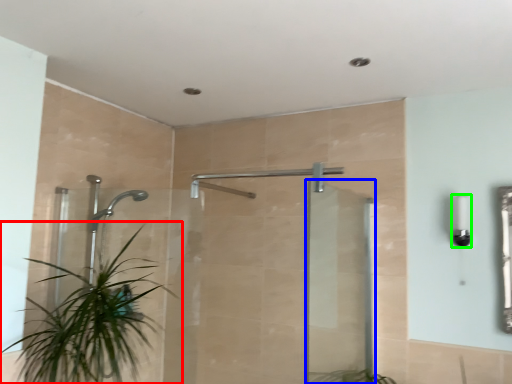
Question: Based on their relative distances, which object is nearer to houseplant (highlighted by a red box)? Choose from screen door (highlighted by a blue box) and light fixture (highlighted by a green box).

Choices:
 (A) screen door
 (B) light fixture

Answer: (A)